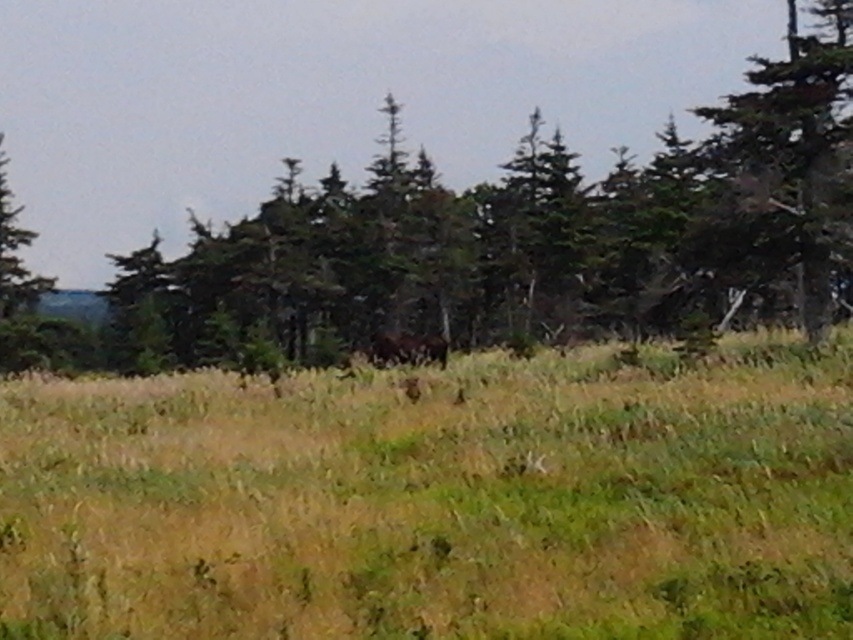
Describe the element at coordinates (437, 499) in the screenshot. I see `green grassy pasture at center` at that location.

What are the coordinates of `green grassy pasture at center` in the screenshot? It's located at (437, 499).

Does green grassy pasture at center have a larger size compared to green textured tree at right?

No, green grassy pasture at center is not bigger than green textured tree at right.

Does green grassy pasture at center appear over green textured tree at right?

Actually, green grassy pasture at center is below green textured tree at right.

Image resolution: width=853 pixels, height=640 pixels. What do you see at coordinates (437, 499) in the screenshot?
I see `green grassy pasture at center` at bounding box center [437, 499].

The width and height of the screenshot is (853, 640). I want to click on green grassy pasture at center, so click(437, 499).

Which is below, green textured trees at upper center or green textured tree at right?

Positioned lower is green textured trees at upper center.

Who is shorter, green textured trees at upper center or green textured tree at right?

Standing shorter between the two is green textured trees at upper center.

Which is in front, point (334, 186) or point (750, 184)?

Point (750, 184) is more forward.

At what (x,y) coordinates should I click in order to perform the action: click on green textured trees at upper center. Please return your answer as a coordinate pair (x, y). The height and width of the screenshot is (640, 853). Looking at the image, I should click on (506, 240).